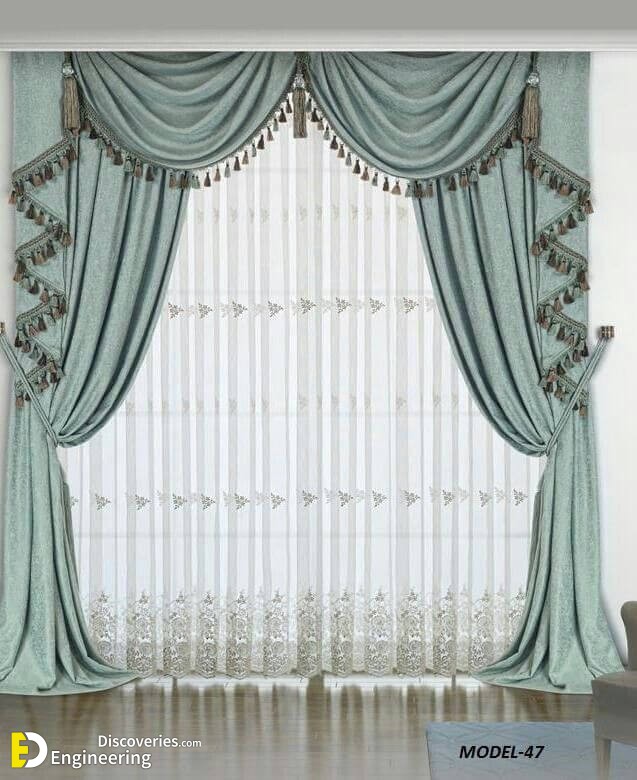
The image size is (637, 780). What are the coordinates of `large tassle` in the screenshot? It's located at (69, 80), (297, 94), (534, 101).